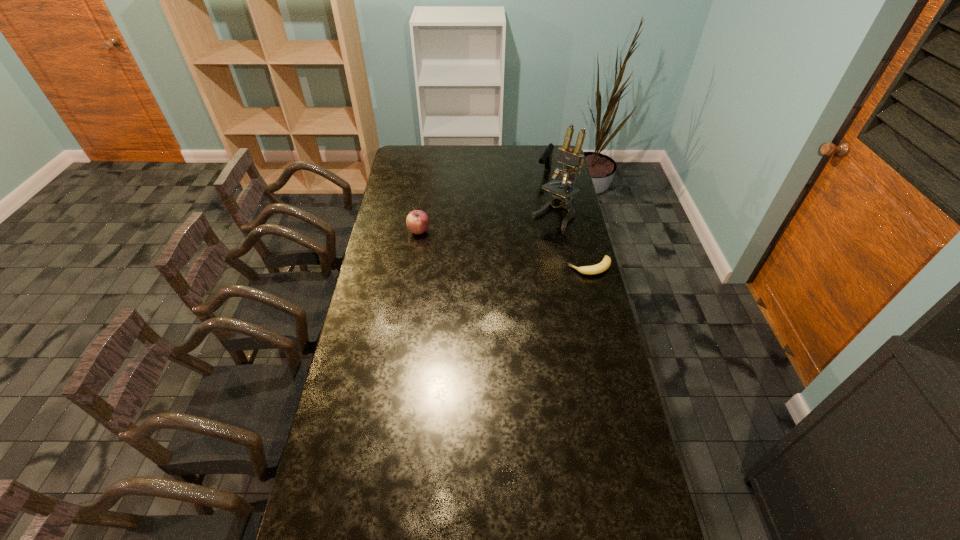
Identify the location of free region located 0.320m at the barrel of the pistol. (520, 217).

The width and height of the screenshot is (960, 540). I want to click on vacant space located 0.300m at the barrel of the pistol, so click(521, 214).

Where is `free space located 0.340m at the eyepieces of the tallest object`? free space located 0.340m at the eyepieces of the tallest object is located at coordinates (499, 269).

The width and height of the screenshot is (960, 540). Identify the location of vacant region located 0.190m at the eyepieces of the tallest object. (519, 250).

Identify the location of free spot located at the eyepieces of the tallest object. (500, 268).

Where is `object at the far edge`? object at the far edge is located at coordinates (546, 158).

The width and height of the screenshot is (960, 540). In order to click on object that is at the left edge in this screenshot , I will do `click(417, 221)`.

Image resolution: width=960 pixels, height=540 pixels. In order to click on banana positioned at the right edge in this screenshot , I will do `click(606, 262)`.

Locate an element on the screen. The height and width of the screenshot is (540, 960). pistol at the right edge is located at coordinates (546, 158).

Image resolution: width=960 pixels, height=540 pixels. In order to click on microscope located in the right edge section of the desktop in this screenshot , I will do `click(571, 158)`.